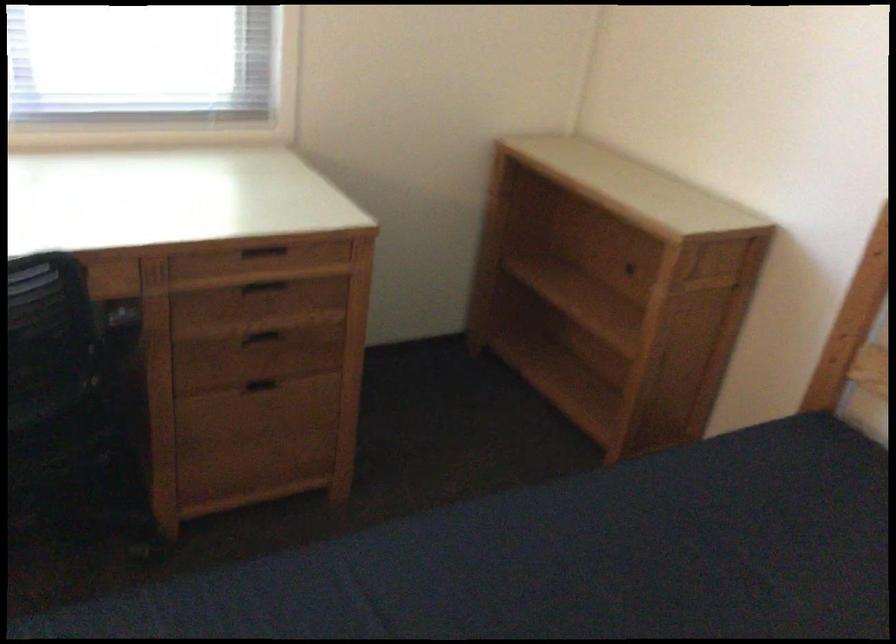
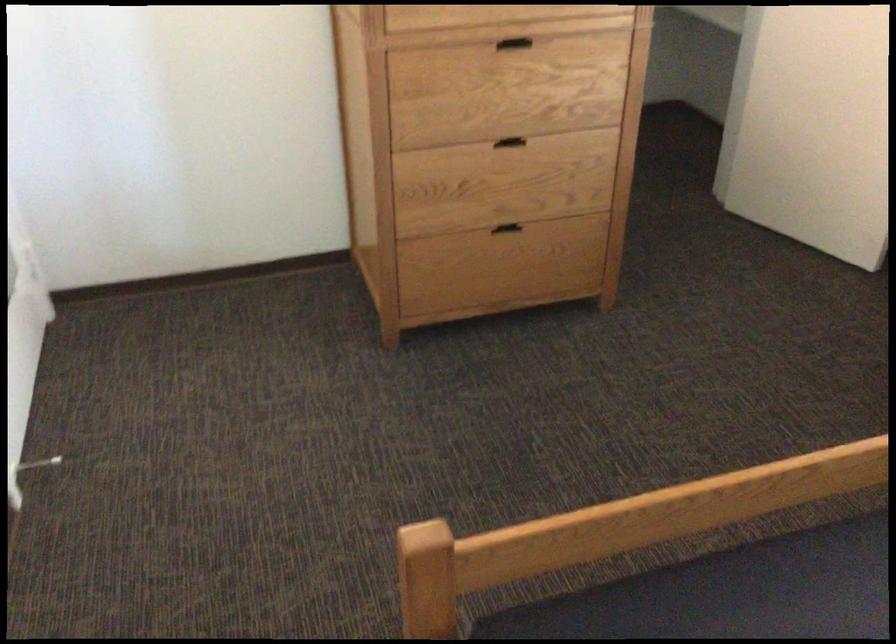
The first image is from the beginning of the video and the second image is from the end. How did the camera likely rotate when shooting the video?

The rotation direction of the camera is left-down.